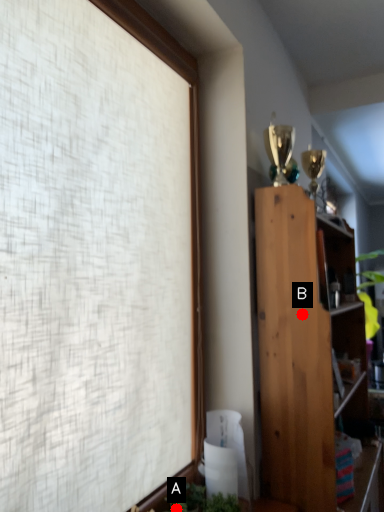
Question: Two points are circled on the image, labeled by A and B beside each circle. Which point is farther from the camera taking this photo?

Choices:
 (A) A is further
 (B) B is further

Answer: (B)